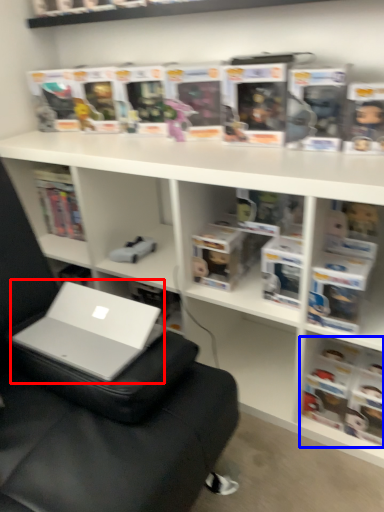
Question: Which object appears farthest to the camera in this image, laptop (highlighted by a red box) or book (highlighted by a blue box)?

Choices:
 (A) laptop
 (B) book

Answer: (B)